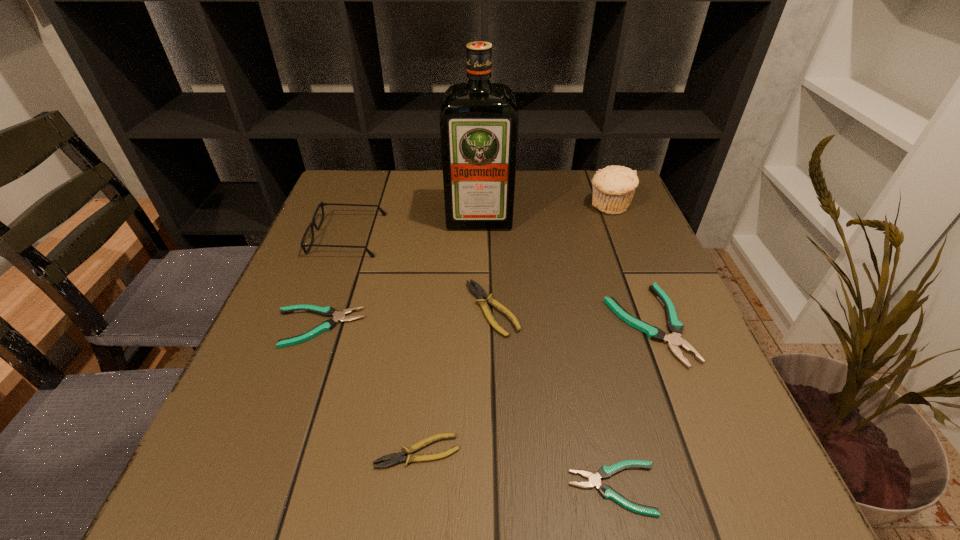
The image size is (960, 540). I want to click on liquor, so click(x=479, y=121).

Where is `the seventh shortest object`? The height and width of the screenshot is (540, 960). the seventh shortest object is located at coordinates [x=613, y=186].

Identify the location of muffin. (613, 186).

Locate an element on the screen. The image size is (960, 540). the sixth shortest object is located at coordinates (313, 224).

Where is `the biggest teal pliers`? the biggest teal pliers is located at coordinates (674, 339).

Locate an element on the screen. This screenshot has height=540, width=960. the rightmost pliers is located at coordinates (674, 339).

Locate an element on the screen. The image size is (960, 540). the bigger yellow pliers is located at coordinates (477, 291).

At what (x,y) coordinates should I click in order to perform the action: click on the farther yellow pliers. Please return your answer as a coordinate pair (x, y). The width and height of the screenshot is (960, 540). Looking at the image, I should click on (477, 291).

Identify the location of the leftmost teal pliers. (327, 311).

Locate an element on the screen. The width and height of the screenshot is (960, 540). the second biggest teal pliers is located at coordinates (327, 311).